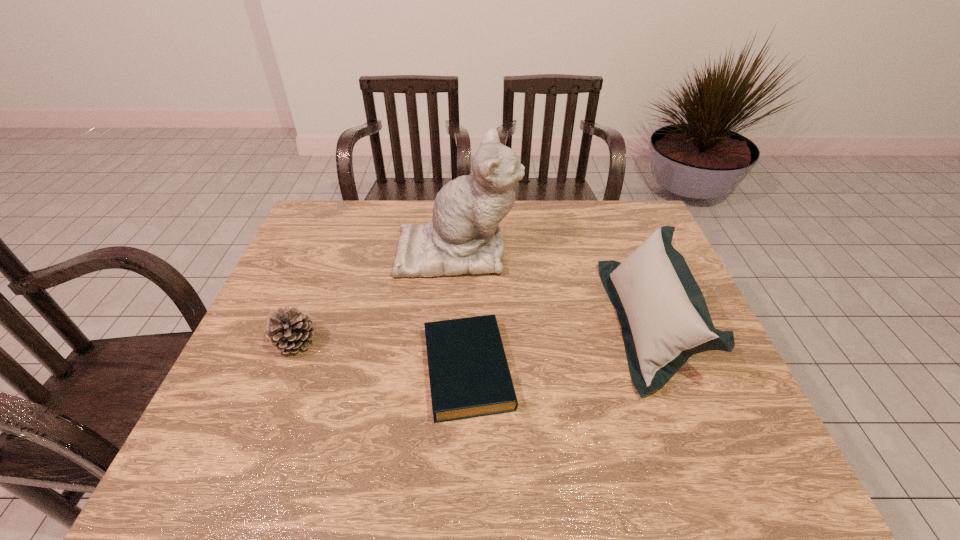
Identify the location of the tallest object. (463, 237).

Identify the location of cushion. This screenshot has width=960, height=540. (664, 318).

Locate an element on the screen. The width and height of the screenshot is (960, 540). the rightmost object is located at coordinates (664, 318).

The height and width of the screenshot is (540, 960). I want to click on pinecone, so click(x=290, y=331).

Locate an element on the screen. This screenshot has width=960, height=540. the leftmost object is located at coordinates (290, 331).

The height and width of the screenshot is (540, 960). Find the location of `the shortest object`. the shortest object is located at coordinates (469, 375).

Where is `free space located on the front-facing side of the cat`? This screenshot has width=960, height=540. free space located on the front-facing side of the cat is located at coordinates (602, 251).

Find the location of a particular element. This screenshot has width=960, height=540. free region located on the surface of the cushion is located at coordinates (492, 323).

Identify the location of vacant space situated 0.240m on the surface of the cushion. (522, 323).

The width and height of the screenshot is (960, 540). Identify the location of free space located 0.360m on the surface of the cushion. (476, 323).